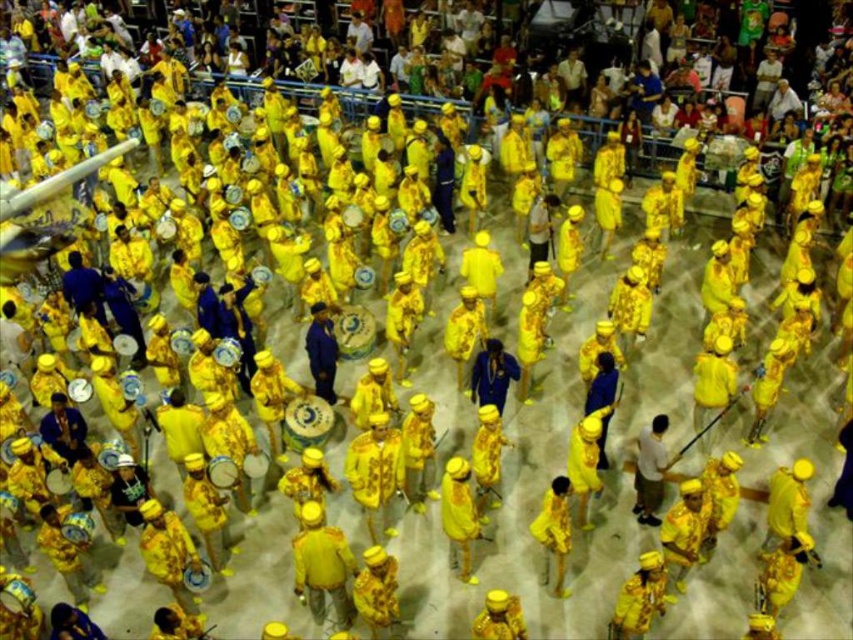
Is the position of yellow fabric hat at center more distant than that of yellow fabric drum at center?

No, it is in front of yellow fabric drum at center.

Between yellow fabric hat at center and yellow fabric drum at center, which one is positioned lower?

yellow fabric hat at center is below.

In order to click on yellow fabric hat at center in this screenshot , I will do `click(322, 566)`.

At what (x,y) coordinates should I click in order to perform the action: click on yellow fabric hat at center. Please return your answer as a coordinate pair (x, y). This screenshot has width=853, height=640. Looking at the image, I should click on (322, 566).

Who is higher up, yellow fabric hat at center or yellow matte uniform at center?

yellow matte uniform at center is higher up.

Is point (321, 572) positioned after point (563, 552)?

No, (321, 572) is closer to viewer.

You are a GUI agent. You are given a task and a screenshot of the screen. Output one action in this format:
    pyautogui.click(x=<x>, y=<y>)
    Task: Click on the yellow fabric hat at center
    The width and height of the screenshot is (853, 640).
    Given the screenshot: What is the action you would take?
    click(322, 566)

Between point (323, 525) and point (494, 362), which one is positioned behind?

Point (494, 362)

Is point (318, 621) positioned in front of point (485, 342)?

Yes, point (318, 621) is closer to viewer.

Is point (318, 580) farther from camera compared to point (483, 380)?

No, (318, 580) is closer to viewer.

Image resolution: width=853 pixels, height=640 pixels. What are the coordinates of `yellow fabric hat at center` in the screenshot? It's located at (322, 566).